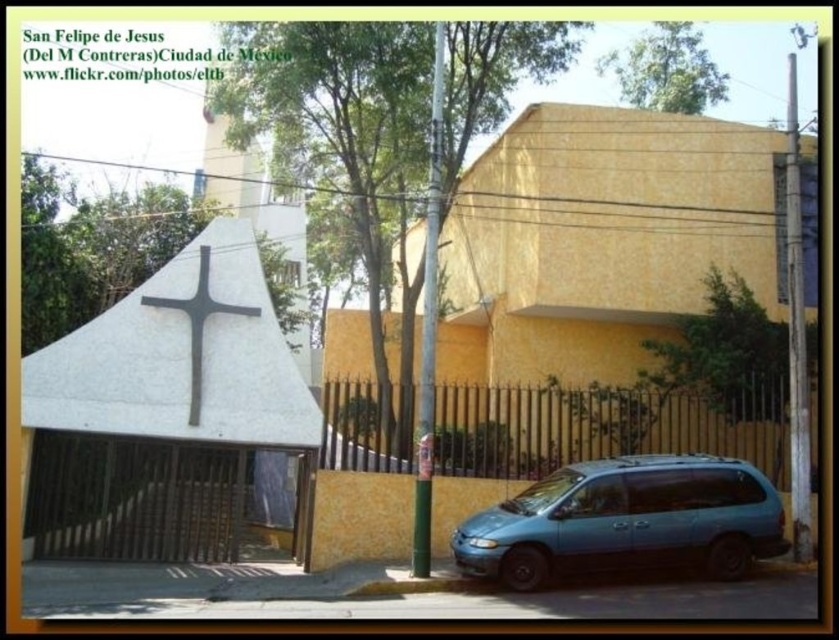
Does white concrete cross at center appear over teal matte minivan at lower right?

Indeed, white concrete cross at center is positioned over teal matte minivan at lower right.

Does white concrete cross at center have a greater width compared to teal matte minivan at lower right?

No.

Who is more forward, (236, 301) or (535, 552)?

Positioned in front is point (535, 552).

Locate an element on the screen. The height and width of the screenshot is (640, 839). white concrete cross at center is located at coordinates (165, 404).

Is yellow stucco chapel at center thinner than white stone cross at center?

Incorrect, yellow stucco chapel at center's width is not less than white stone cross at center's.

This screenshot has width=839, height=640. What are the coordinates of `yellow stucco chapel at center` in the screenshot? It's located at (602, 241).

Locate an element on the screen. The width and height of the screenshot is (839, 640). yellow stucco chapel at center is located at coordinates pos(602,241).

Who is positioned more to the left, yellow stucco chapel at center or teal matte minivan at lower right?

yellow stucco chapel at center

This screenshot has width=839, height=640. I want to click on yellow stucco chapel at center, so click(x=602, y=241).